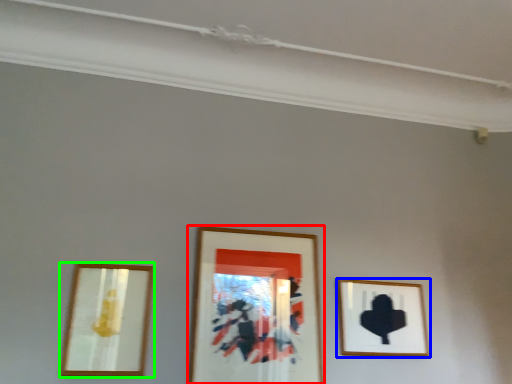
Question: Which object is the closest to the picture frame (highlighted by a red box)? Choose among these: picture frame (highlighted by a blue box) or picture frame (highlighted by a green box).

Choices:
 (A) picture frame
 (B) picture frame

Answer: (A)